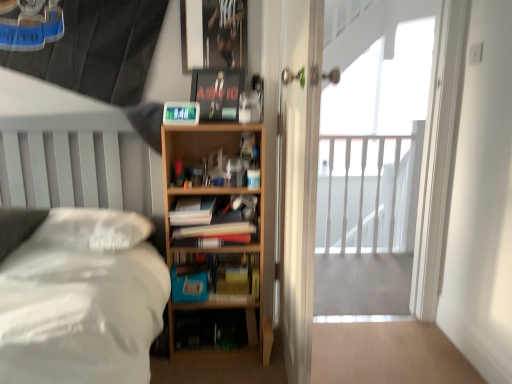
Question: Considering the positions of point (185, 301) and point (159, 317), is point (185, 301) closer or farther from the camera than point (159, 317)?

Choices:
 (A) closer
 (B) farther

Answer: (B)

Question: Relative to white matte bed at left, is blue matte paperback book at lower center, the first paperback book ordered from the bottom, in front or behind?

Choices:
 (A) behind
 (B) front

Answer: (A)

Question: Which object is positioned farthest from the hardcover books at center, the first book from the top?

Choices:
 (A) blue matte paperback book at lower center, which appears as the 2th paperback book when viewed from the top
 (B) white matte bed at left
 (C) wooden bookcase at center
 (D) white glossy screen door at center
 (E) white wooden railing at upper right

Answer: (E)

Question: Which object is positioned closest to the white glossy screen door at center?

Choices:
 (A) white wooden railing at upper right
 (B) hardcover book at center, the first book when ordered from bottom to top
 (C) blue matte paperback book at lower center, the first paperback book ordered from the bottom
 (D) wooden bookcase at center
 (E) matte black paperback book at upper center, placed as the first paperback book when sorted from top to bottom

Answer: (D)